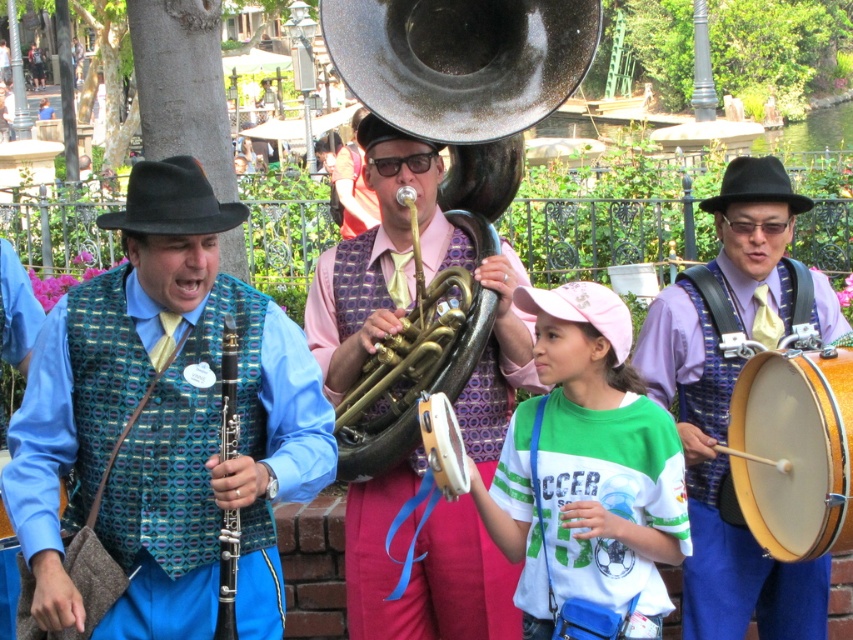
You are a photographer standing in the center of the scene. You want to capture a photo that includes all the musicians, including the matte gold drum at right. Based on their positions, which direction should you move to ensure the drum is fully visible in the frame?

You should move to the left to ensure the matte gold drum at right remains fully visible in the frame.

From the picture: Based on the scene description, where is the gold shiny trumpet at center located in the image?

The gold shiny trumpet at center is located at point (418,355) in the image.